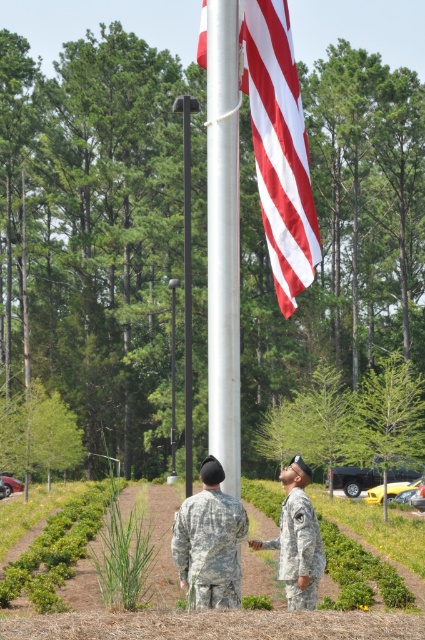
Question: Which point appears farthest from the camera in this image?

Choices:
 (A) (190, 538)
 (B) (291, 593)
 (C) (223, 128)
 (D) (272, 541)

Answer: (D)

Question: Is red/white striped flag at upper center thinner than camouflage fabric uniform at lower center?

Choices:
 (A) no
 (B) yes

Answer: (A)

Question: Does red/white striped flag at upper center appear under camouflage fabric uniform at center?

Choices:
 (A) no
 (B) yes

Answer: (A)

Question: Can you confirm if red/white striped flag at upper center is positioned above silver metallic flag pole at center?

Choices:
 (A) no
 (B) yes

Answer: (A)

Question: Which point is closer to the camera?

Choices:
 (A) (303, 260)
 (B) (238, 355)

Answer: (B)

Question: Which point is farther from the camera taking this photo?

Choices:
 (A) (192, 556)
 (B) (292, 547)
 (C) (232, 1)

Answer: (B)